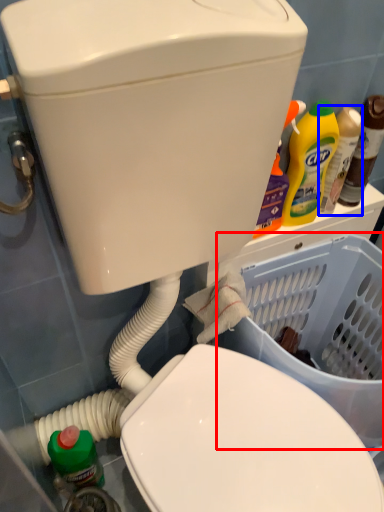
Question: Which point is closer to the camera, basket container (highlighted by a red box) or bottle (highlighted by a blue box)?

Choices:
 (A) basket container
 (B) bottle

Answer: (A)